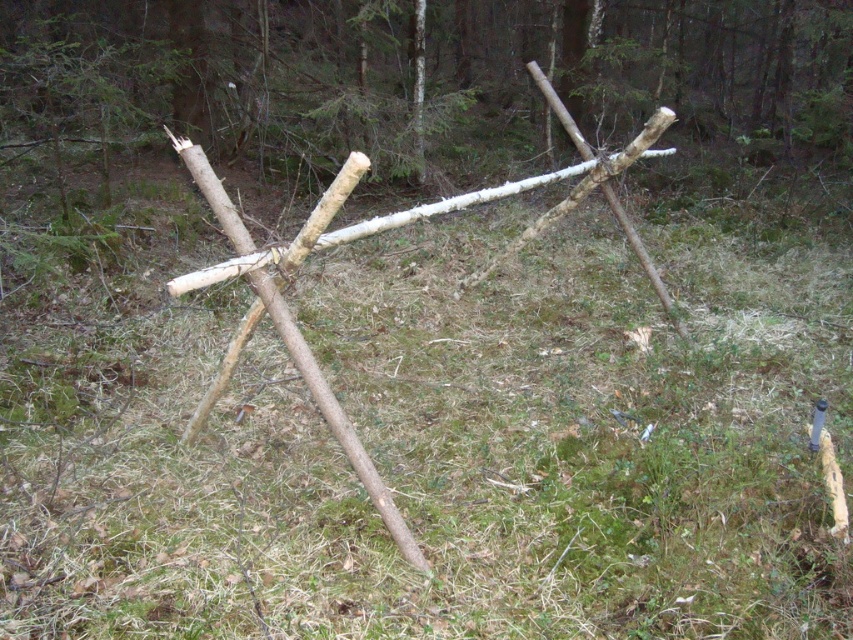
Question: Does green grass at center have a greater width compared to natural wood stick at center?

Choices:
 (A) yes
 (B) no

Answer: (B)

Question: Does green grass at center appear under natural wood stick at center?

Choices:
 (A) yes
 (B) no

Answer: (A)

Question: Which point is farther to the camera?

Choices:
 (A) natural wood stick at center
 (B) green grass at center

Answer: (A)

Question: Can you confirm if green grass at center is positioned below natural wood stick at center?

Choices:
 (A) no
 (B) yes

Answer: (B)

Question: Which point is closer to the camera?

Choices:
 (A) (694, 321)
 (B) (56, 33)

Answer: (A)